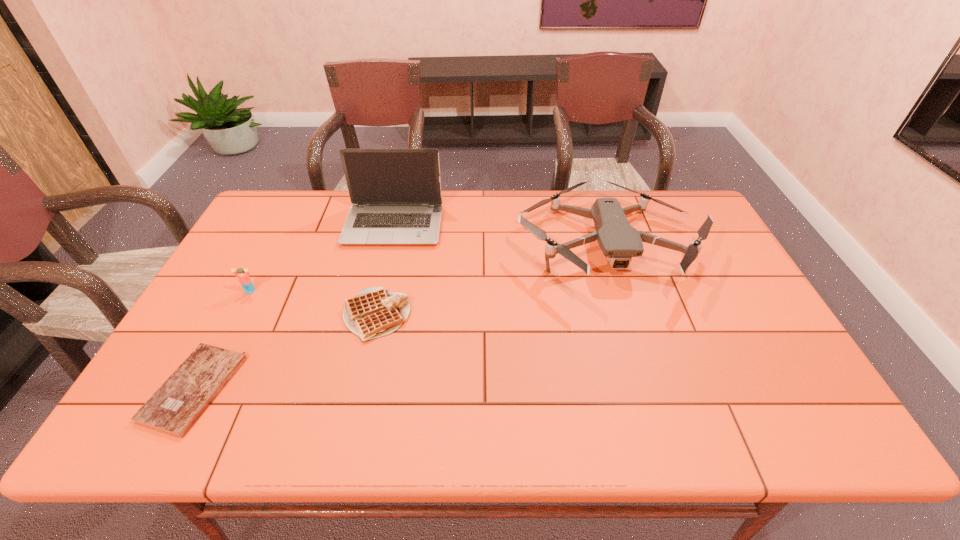
I want to click on vacant space at the far edge of the desktop, so click(566, 198).

In the image, there is a desktop. At what (x,y) coordinates should I click in order to perform the action: click on vacant region at the near edge. Please return your answer as a coordinate pair (x, y). The image size is (960, 540). Looking at the image, I should click on (x=382, y=431).

Where is `vacant point at the left edge`? The width and height of the screenshot is (960, 540). vacant point at the left edge is located at coordinates (262, 298).

Image resolution: width=960 pixels, height=540 pixels. In the image, there is a desktop. Identify the location of free space at the right edge. (780, 373).

The height and width of the screenshot is (540, 960). I want to click on vacant position at the far left corner of the desktop, so click(x=301, y=225).

Image resolution: width=960 pixels, height=540 pixels. Identify the location of free spot at the far right corner of the desktop. (677, 205).

The width and height of the screenshot is (960, 540). I want to click on vacant area that lies between the tallest object and the second shortest object, so click(x=385, y=271).

This screenshot has height=540, width=960. I want to click on vacant point located between the laptop computer and the shortest object, so click(294, 308).

Locate an element on the screen. vacant area that lies between the fourth shortest object and the laptop computer is located at coordinates (500, 235).

At what (x,y) coordinates should I click in order to perform the action: click on vacant space in between the Lego and the waffle. Please return your answer as a coordinate pair (x, y). The width and height of the screenshot is (960, 540). Looking at the image, I should click on (314, 303).